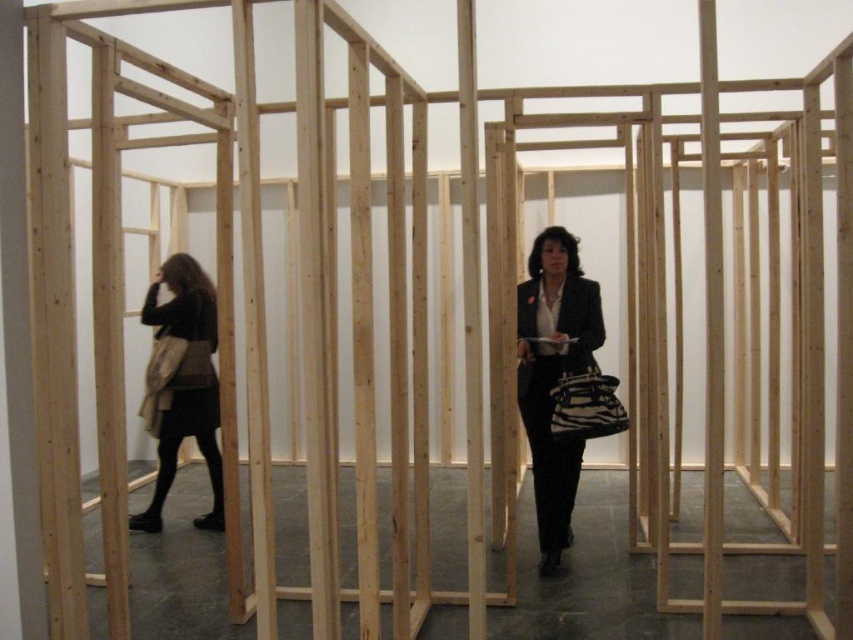
Question: Can you confirm if matte black blazer at center is positioned below matte black coat at left?

Choices:
 (A) no
 (B) yes

Answer: (A)

Question: Observing the image, what is the correct spatial positioning of matte black blazer at center in reference to matte black coat at left?

Choices:
 (A) right
 (B) left

Answer: (A)

Question: Can you confirm if matte black blazer at center is positioned above matte black coat at left?

Choices:
 (A) no
 (B) yes

Answer: (B)

Question: Which point appears farthest from the camera in this image?

Choices:
 (A) (219, 460)
 (B) (572, 310)

Answer: (A)